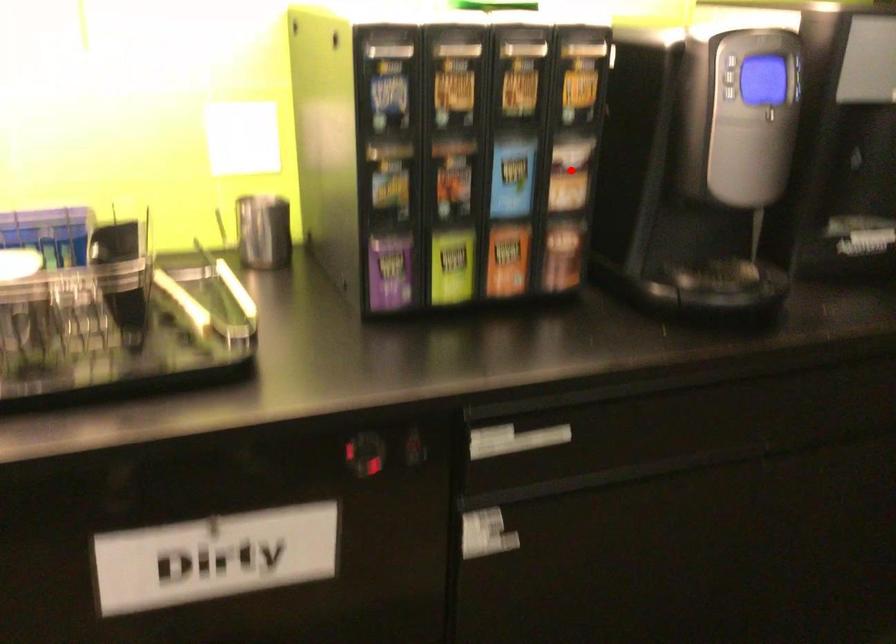
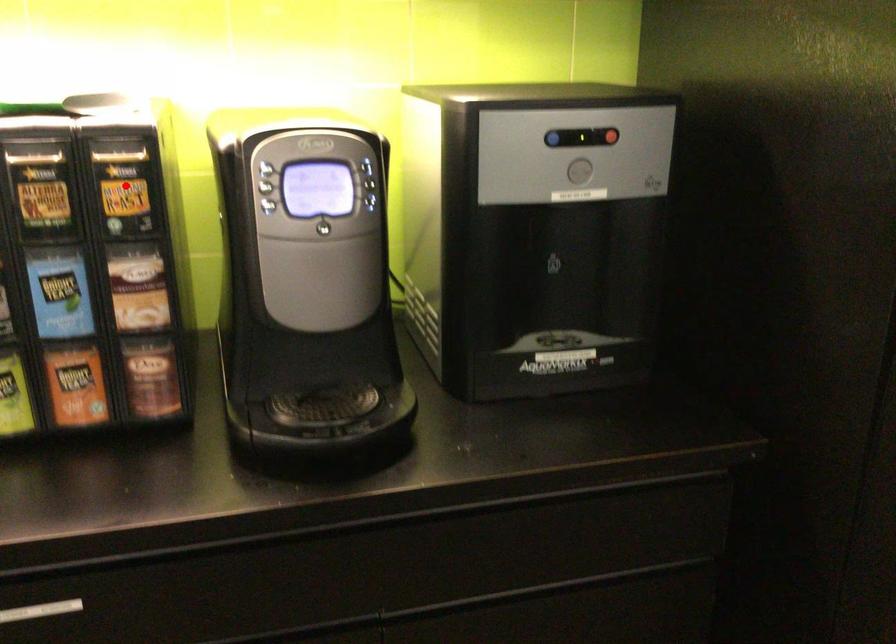
I am providing you with two images of the same scene from different viewpoints. A red point is marked on the first image and another point is marked on the second image. Do the highlighted points in image1 and image2 indicate the same real-world spot?

No